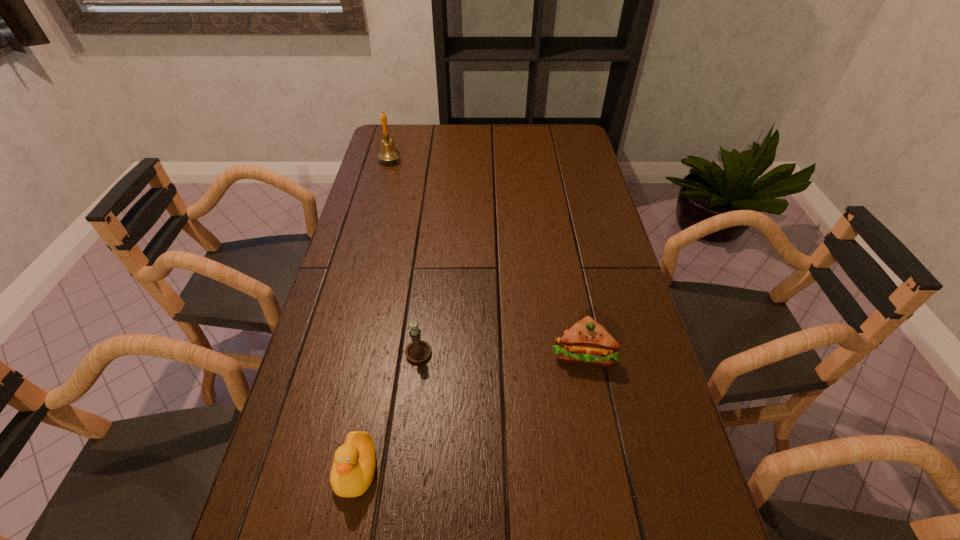
At what (x,y) coordinates should I click in order to perform the action: click on free space located 0.100m on the side of the candle holder with the handle. Please return your answer as a coordinate pair (x, y). Looking at the image, I should click on (423, 306).

I want to click on vacant space situated 0.050m on the face of the duck, so (x=345, y=531).

The width and height of the screenshot is (960, 540). I want to click on object located in the far edge section of the desktop, so click(388, 152).

Where is `bell present at the left edge`? This screenshot has height=540, width=960. bell present at the left edge is located at coordinates (388, 152).

Where is `duck situated at the left edge`? duck situated at the left edge is located at coordinates (353, 469).

At what (x,y) coordinates should I click in order to perform the action: click on object that is at the right edge. Please return your answer as a coordinate pair (x, y). This screenshot has height=540, width=960. Looking at the image, I should click on (587, 341).

At what (x,y) coordinates should I click in order to perform the action: click on object that is at the far left corner. Please return your answer as a coordinate pair (x, y). This screenshot has width=960, height=540. Looking at the image, I should click on pyautogui.click(x=388, y=152).

Find the location of a particular element. The image size is (960, 540). vacant area at the left edge of the desktop is located at coordinates (362, 240).

This screenshot has height=540, width=960. In the image, there is a desktop. Find the location of `vacant space at the right edge`. vacant space at the right edge is located at coordinates (575, 275).

Locate an element on the screen. vacant region at the far left corner of the desktop is located at coordinates (380, 146).